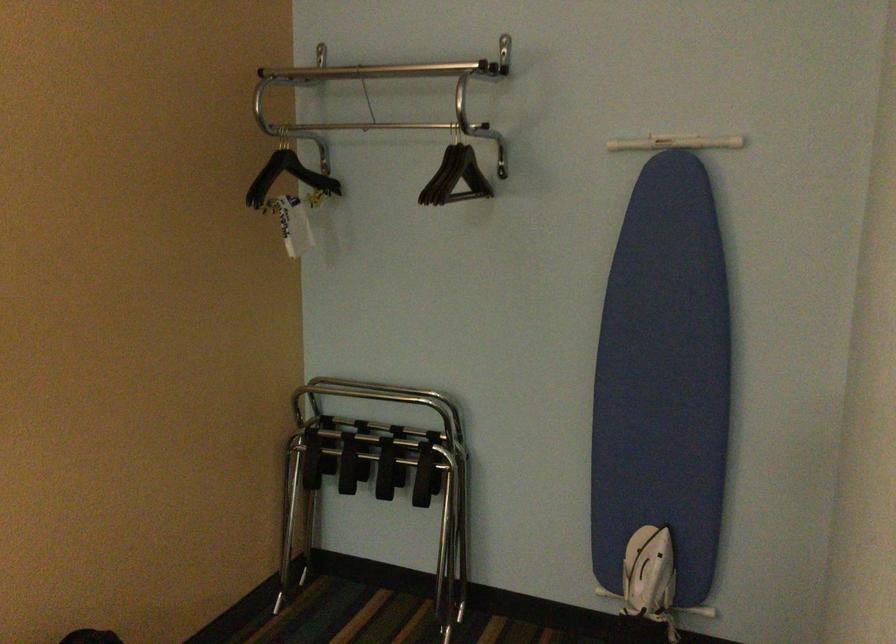
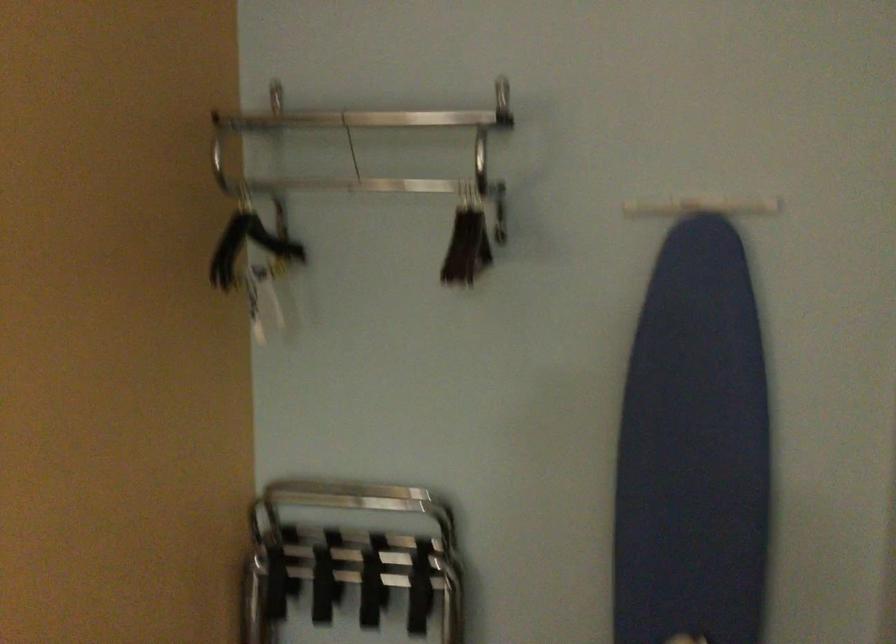
Find the pixel in the second image that matches (x=401, y=95) in the first image.

(381, 147)